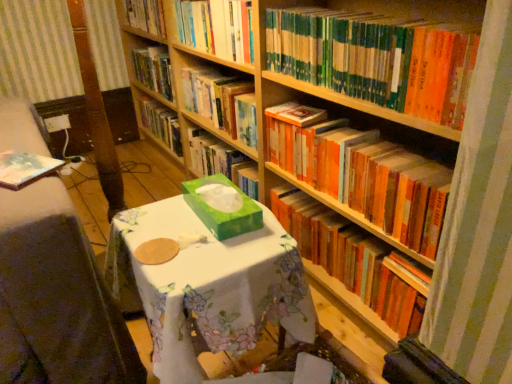
Question: From a real-world perspective, is hardcover book at center, which is the second book in top-to-bottom order, on hardcover books at upper center, positioned as the 1th book in top-to-bottom order?

Choices:
 (A) yes
 (B) no

Answer: (B)

Question: From the image's perspective, does hardcover book at center, which is the second book in top-to-bottom order, appear higher than hardcover books at upper center, which appears as the fifth book when ordered from the bottom?

Choices:
 (A) no
 (B) yes

Answer: (A)

Question: Is hardcover book at center, acting as the fourth book starting from the bottom, taller than hardcover books at upper center, positioned as the 1th book in top-to-bottom order?

Choices:
 (A) no
 (B) yes

Answer: (B)

Question: Could hardcover books at upper center, positioned as the 1th book in top-to-bottom order, be considered to be inside hardcover book at center, acting as the fourth book starting from the bottom?

Choices:
 (A) no
 (B) yes

Answer: (A)

Question: From the image's perspective, is hardcover book at center, acting as the fourth book starting from the bottom, under hardcover books at upper center, which appears as the fifth book when ordered from the bottom?

Choices:
 (A) yes
 (B) no

Answer: (A)

Question: From a real-world perspective, relative to hardcover book at center, acting as the fourth book starting from the bottom, is orange matte bookshelf at center, the 5th book from the top, vertically above or below?

Choices:
 (A) below
 (B) above

Answer: (A)

Question: Looking at the image, does orange matte bookshelf at center, which is the 1th book from bottom to top, seem bigger or smaller compared to hardcover book at center, acting as the fourth book starting from the bottom?

Choices:
 (A) small
 (B) big

Answer: (A)

Question: In the image, is orange matte bookshelf at center, which is the 1th book from bottom to top, positioned in front of or behind hardcover book at center, which is the second book in top-to-bottom order?

Choices:
 (A) behind
 (B) front

Answer: (B)

Question: Is point (358, 236) closer or farther from the camera than point (236, 119)?

Choices:
 (A) farther
 (B) closer

Answer: (B)

Question: Considering the positions of green matte bookshelf at upper right, which is the 3th book in top-to-bottom order, and orange matte bookshelf at center, the 5th book from the top, in the image, is green matte bookshelf at upper right, which is the 3th book in top-to-bottom order, bigger or smaller than orange matte bookshelf at center, the 5th book from the top,?

Choices:
 (A) small
 (B) big

Answer: (B)

Question: From the image's perspective, is green matte bookshelf at upper right, marked as the 3th book in a bottom-to-top arrangement, positioned above or below orange matte bookshelf at center, which is the 1th book from bottom to top?

Choices:
 (A) below
 (B) above

Answer: (B)

Question: Relative to orange matte bookshelf at center, which is the 1th book from bottom to top, is green matte bookshelf at upper right, marked as the 3th book in a bottom-to-top arrangement, in front or behind?

Choices:
 (A) front
 (B) behind

Answer: (A)

Question: From their relative heights in the image, would you say green matte bookshelf at upper right, which is the 3th book in top-to-bottom order, is taller or shorter than orange matte bookshelf at center, which is the 1th book from bottom to top?

Choices:
 (A) tall
 (B) short

Answer: (B)

Question: From their relative heights in the image, would you say orange matte bookshelf at upper right, marked as the 4th book in a top-to-bottom arrangement, is taller or shorter than green matte tissue box at center?

Choices:
 (A) tall
 (B) short

Answer: (A)

Question: Considering the positions of orange matte bookshelf at upper right, positioned as the 2th book in bottom-to-top order, and green matte tissue box at center in the image, is orange matte bookshelf at upper right, positioned as the 2th book in bottom-to-top order, bigger or smaller than green matte tissue box at center?

Choices:
 (A) small
 (B) big

Answer: (B)